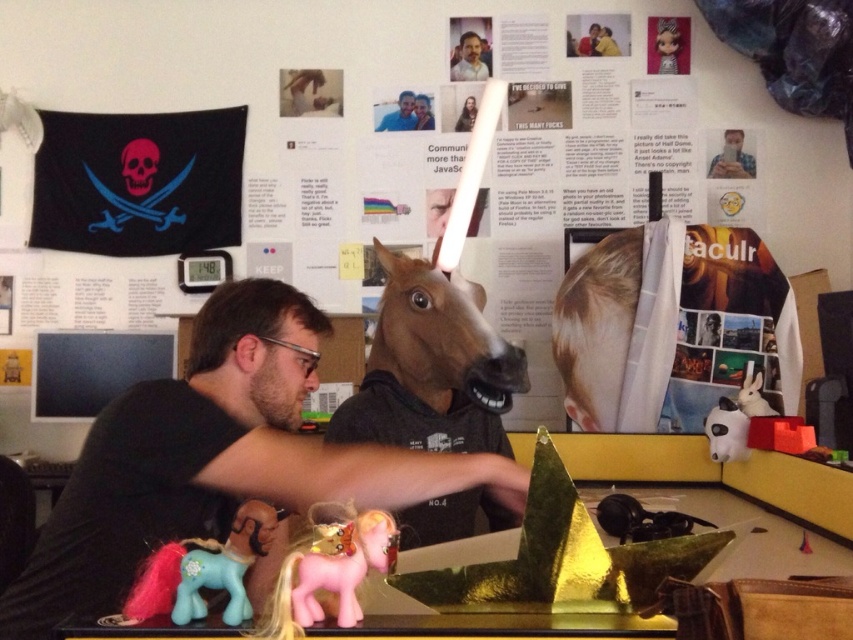
Who is more forward, (x=488, y=556) or (x=468, y=44)?

Point (x=488, y=556)

Is pink plastic toy horse at lower left wider than white matte man at upper center?

Indeed, pink plastic toy horse at lower left has a greater width compared to white matte man at upper center.

Where is `pink plastic toy horse at lower left`? This screenshot has width=853, height=640. pink plastic toy horse at lower left is located at coordinates (752, 532).

Which is above, pastel pink plastic pony at lower left or matte black horse head at center?

matte black horse head at center is higher up.

Find the location of `pastel pink plastic pony at lower left`. pastel pink plastic pony at lower left is located at coordinates (202, 570).

Is matte black horse mask at upper center taller than matte black horse head at center?

Yes.

Which is more to the left, matte black horse mask at upper center or matte black horse head at center?

matte black horse head at center is more to the left.

What do you see at coordinates (732, 157) in the screenshot? Image resolution: width=853 pixels, height=640 pixels. I see `matte black horse mask at upper center` at bounding box center [732, 157].

You are a GUI agent. You are given a task and a screenshot of the screen. Output one action in this format:
    pyautogui.click(x=<x>, y=<y>)
    Task: Click on the matte black horse mask at upper center
    
    Given the screenshot: What is the action you would take?
    pyautogui.click(x=732, y=157)